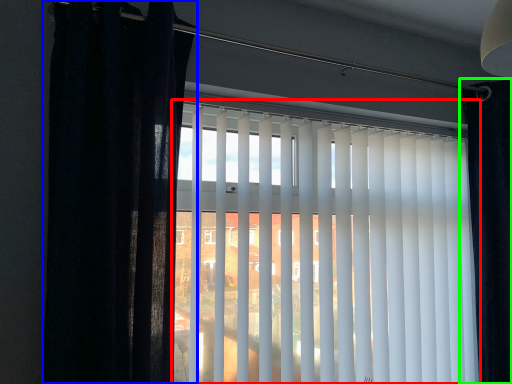
Question: Which is farther away from window blind (highlighted by a red box)? curtain (highlighted by a blue box) or curtain (highlighted by a green box)?

Choices:
 (A) curtain
 (B) curtain

Answer: (B)